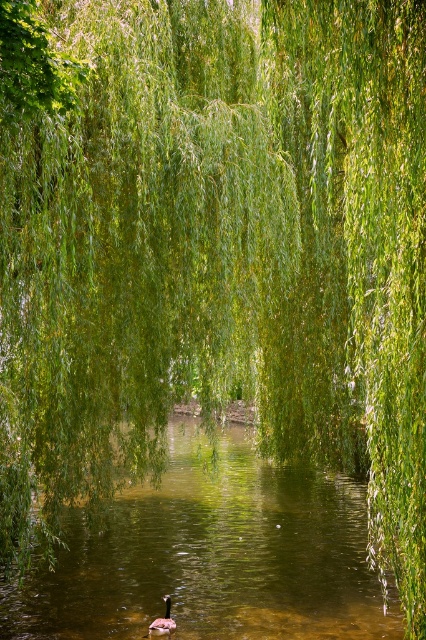
Question: Estimate the real-world distances between objects in this image. Which object is closer to the green leafy willow at center?

Choices:
 (A) green leafy river at center
 (B) brown fuzzy duck at center

Answer: (A)

Question: Observing the image, what is the correct spatial positioning of green leafy river at center in reference to brown fuzzy duck at center?

Choices:
 (A) above
 (B) below

Answer: (A)

Question: Which point is farther from the camera taking this photo?

Choices:
 (A) (169, 602)
 (B) (135, 632)

Answer: (B)

Question: Which object is positioned farthest from the brown fuzzy duck at center?

Choices:
 (A) green leafy river at center
 (B) green leafy willow at center

Answer: (B)

Question: Can you confirm if green leafy river at center is wider than brown fuzzy duck at center?

Choices:
 (A) yes
 (B) no

Answer: (A)

Question: Can you confirm if green leafy willow at center is thinner than brown fuzzy duck at center?

Choices:
 (A) yes
 (B) no

Answer: (B)